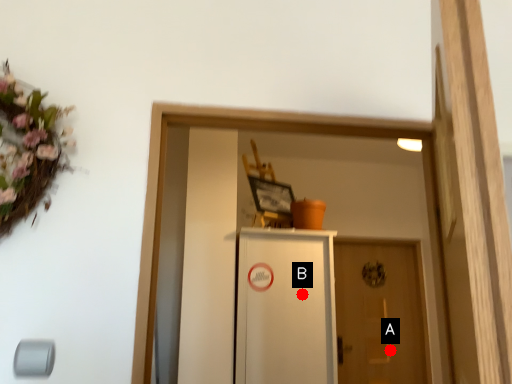
Question: Two points are circled on the image, labeled by A and B beside each circle. Which point is farther to the camera?

Choices:
 (A) A is further
 (B) B is further

Answer: (A)